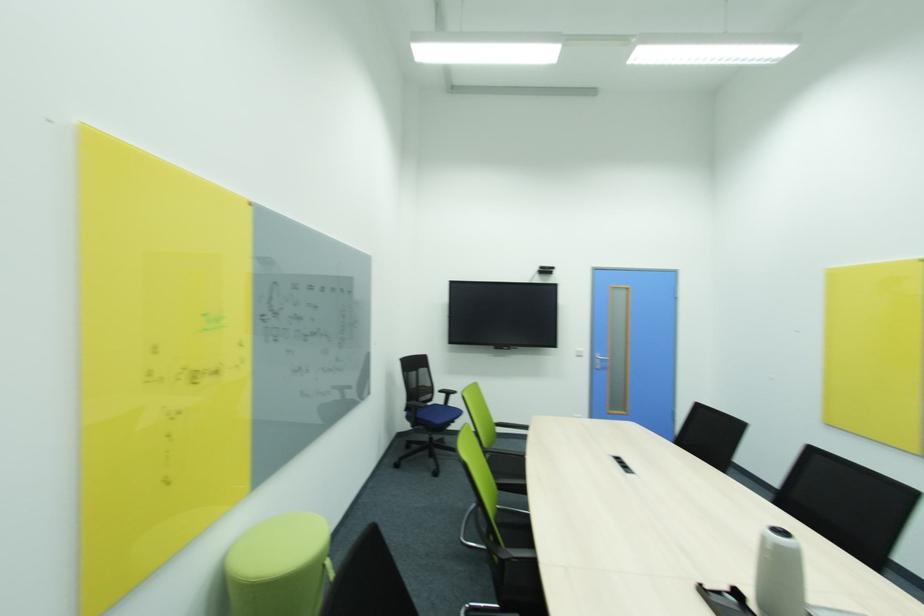
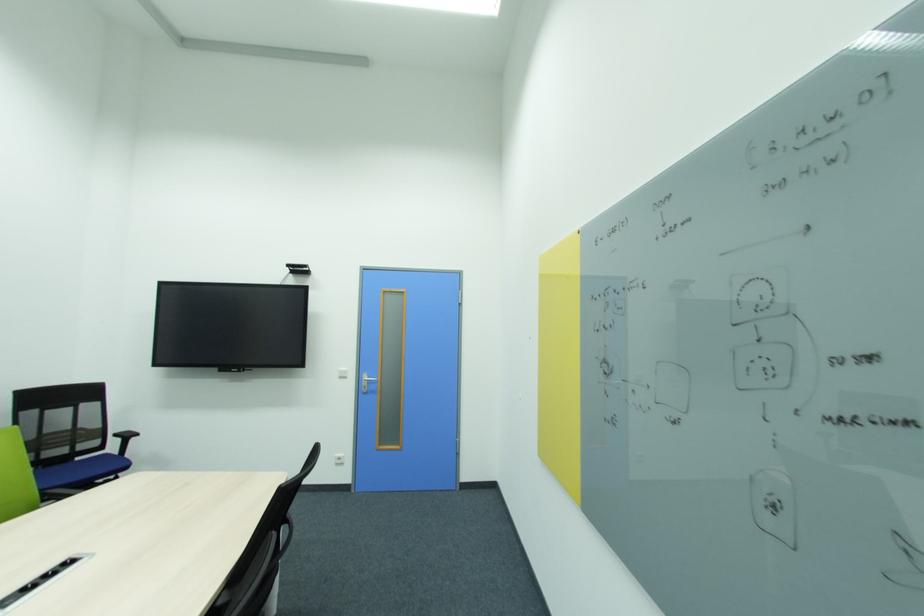
Locate, in the second image, the point that corresponds to point 602,368 in the first image.

(370, 392)